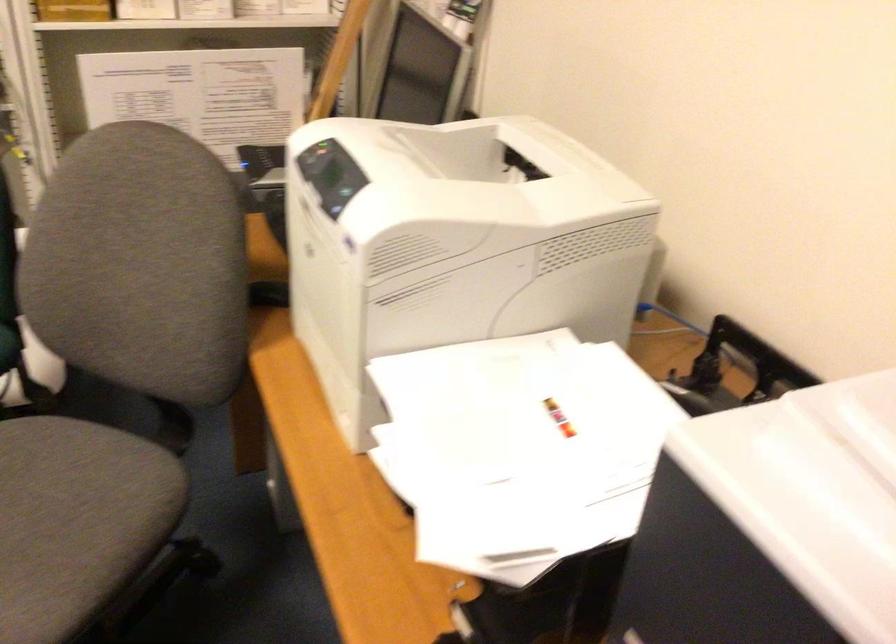
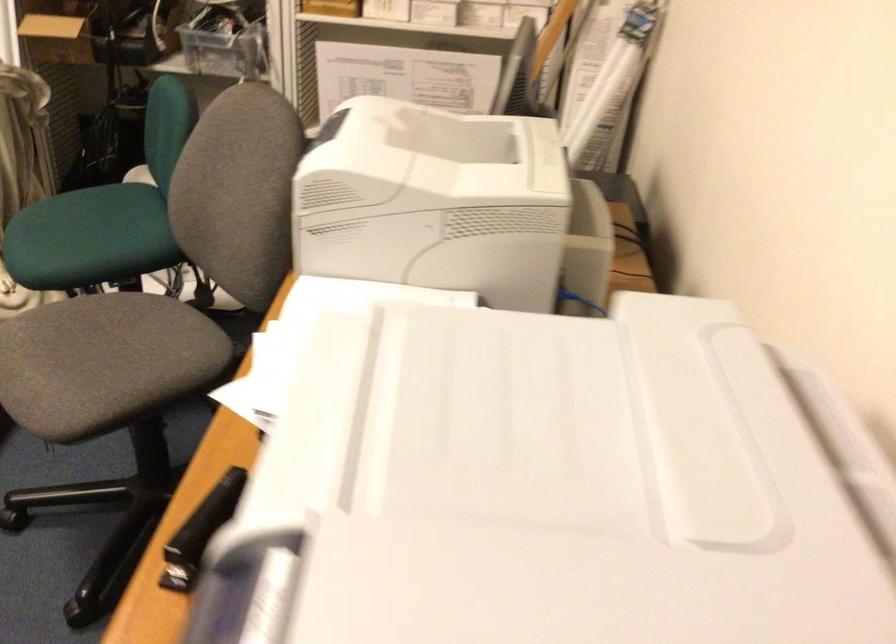
Question: Which direction would the cameraman need to move to produce the second image? Reply with the corresponding letter.

Choices:
 (A) Left
 (B) Right
 (C) Forward
 (D) Backward

Answer: (B)